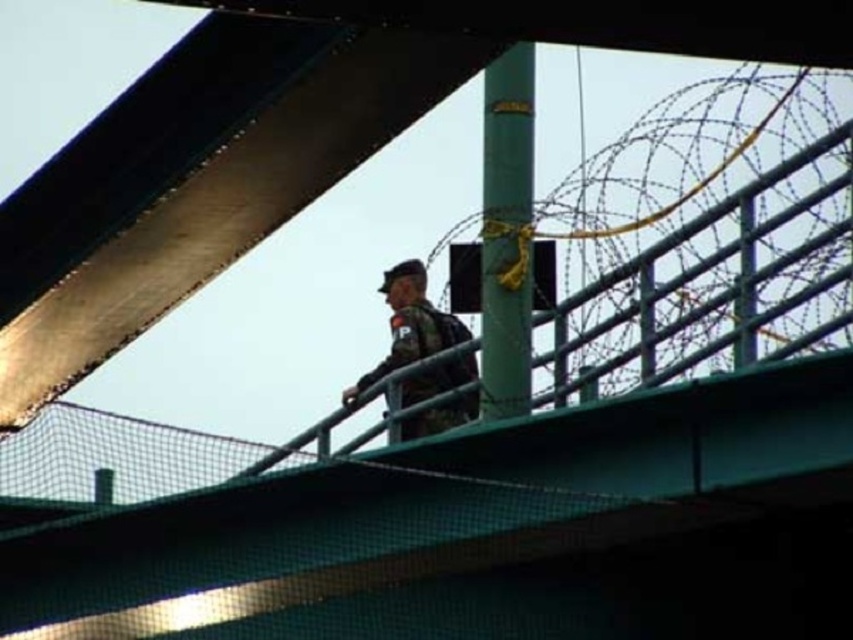
You are a visitor at this checkpoint and need to determine if you can see over the black mesh fence at upper center from behind the camouflage fabric uniform at center. Can you see over it?

The black mesh fence at upper center has a lesser height compared to camouflage fabric uniform at center, so yes, you can see over the black mesh fence at upper center from behind the camouflage fabric uniform at center since the uniform is taller than the fence.

You are a visitor at this checkpoint and need to identify the closest object to you between the black mesh fence at upper center and the camouflage fabric uniform at center. Which one should you point out?

The black mesh fence at upper center is closer to the viewer than the camouflage fabric uniform at center, so you should point out the black mesh fence at upper center.